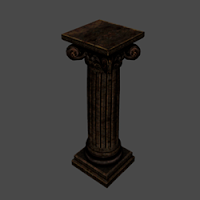
Where is `top of pedestal`? top of pedestal is located at coordinates (105, 36).